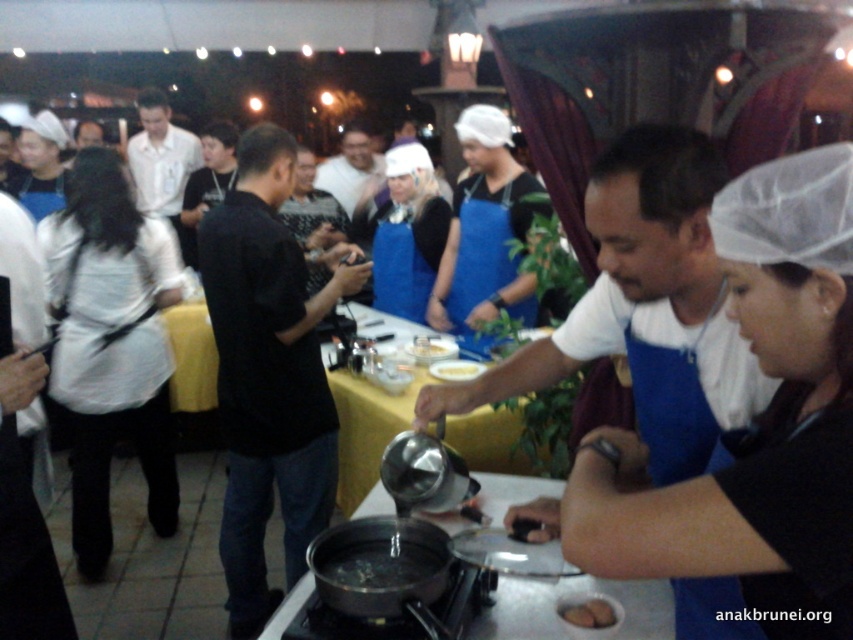
You are a participant in the cooking class and need to hand a recipe card to the instructor. The instructor is wearing the black matte shirt at center. Where should you walk to find the instructor relative to the blue fabric apron at center?

The instructor wearing the black matte shirt at center is to the left of the blue fabric apron at center, so you should walk to the left side of the blue fabric apron at center to find them.

You are a participant in the cooking class and need to wear both the blue fabric apron at center and the black matte shirt at center. Which one should you put on first to ensure proper coverage?

The blue fabric apron at center has a larger width than the black matte shirt at center, so you should put on the black matte shirt at center first to ensure it is fully covered by the apron.

You are a photographer standing at the front of the cooking demonstration. You want to take a closeup photo of the blue fabric apron at center without including any people in the background. Considering the apron is 36.80 inches from the camera, what is the minimum distance you need to move backward to ensure the background is out of focus?

The blue fabric apron at center is 36.80 inches from the camera. To ensure the background is out of focus, you need to move backward until the camera is at least 36.80 inches away from the apron. However, this might not be sufficient depending on the lens aperture. A better approach is to use a wide aperture setting to minimize depth of field, allowing the apron to be in focus while blurring the background without moving the camera.